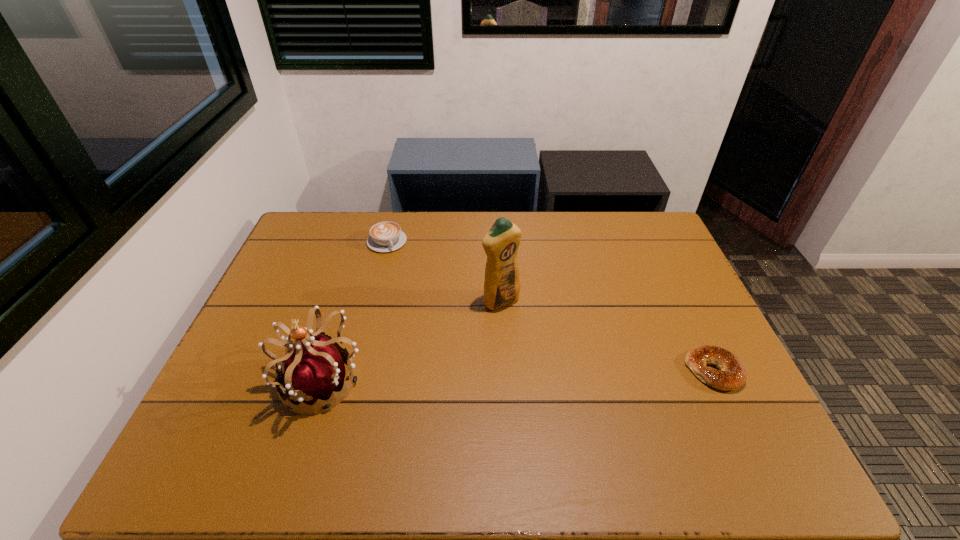
The height and width of the screenshot is (540, 960). In order to click on tiara in this screenshot , I will do `click(314, 370)`.

You are a GUI agent. You are given a task and a screenshot of the screen. Output one action in this format:
    pyautogui.click(x=<x>, y=<y>)
    Task: Click on the bagel
    This screenshot has height=540, width=960.
    Given the screenshot: What is the action you would take?
    pyautogui.click(x=731, y=375)

Locate an element on the screen. This screenshot has width=960, height=540. the rightmost object is located at coordinates (731, 375).

Image resolution: width=960 pixels, height=540 pixels. Find the location of `the tallest object`. the tallest object is located at coordinates (502, 285).

Locate an element on the screen. The image size is (960, 540). the second farthest object is located at coordinates (502, 285).

You are a GUI agent. You are given a task and a screenshot of the screen. Output one action in this format:
    pyautogui.click(x=<x>, y=<y>)
    Task: Click on the second shortest object
    This screenshot has width=960, height=540.
    Given the screenshot: What is the action you would take?
    pyautogui.click(x=387, y=236)

The height and width of the screenshot is (540, 960). In order to click on the farthest object in this screenshot , I will do `click(387, 236)`.

Image resolution: width=960 pixels, height=540 pixels. I want to click on free location located 0.120m on the front-facing side of the third shortest object, so (229, 381).

Find the location of `free space located on the front-facing side of the third shortest object`. free space located on the front-facing side of the third shortest object is located at coordinates (226, 381).

Locate an element on the screen. This screenshot has width=960, height=540. free spot located 0.250m on the back of the shortest object is located at coordinates (673, 287).